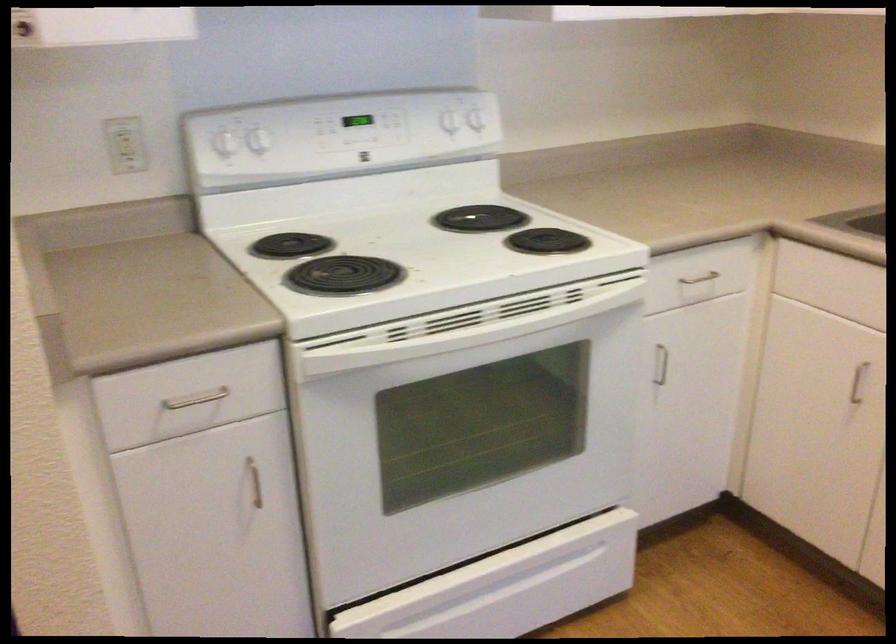
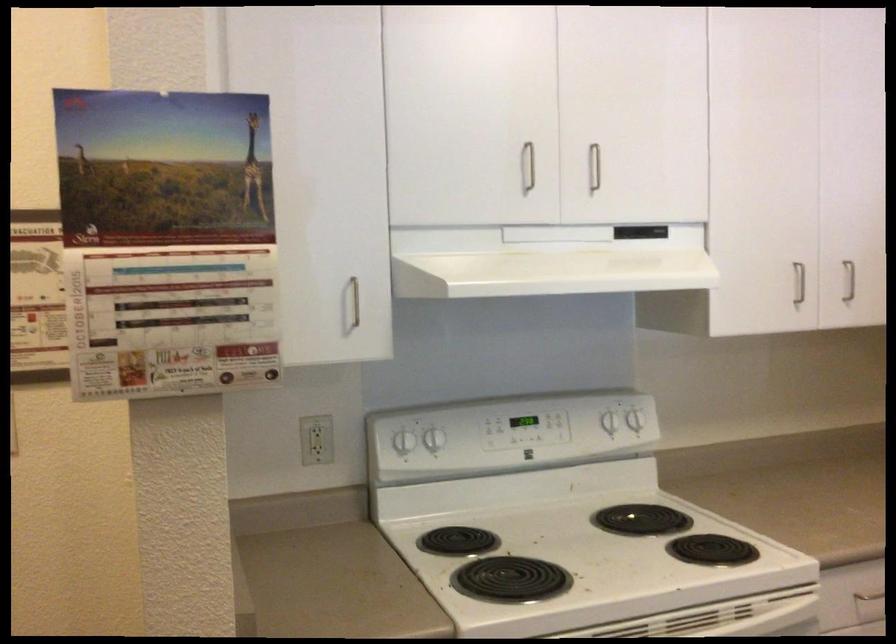
Which direction would the cameraman need to move to produce the second image?

The movement direction of the cameraman is left, backward.